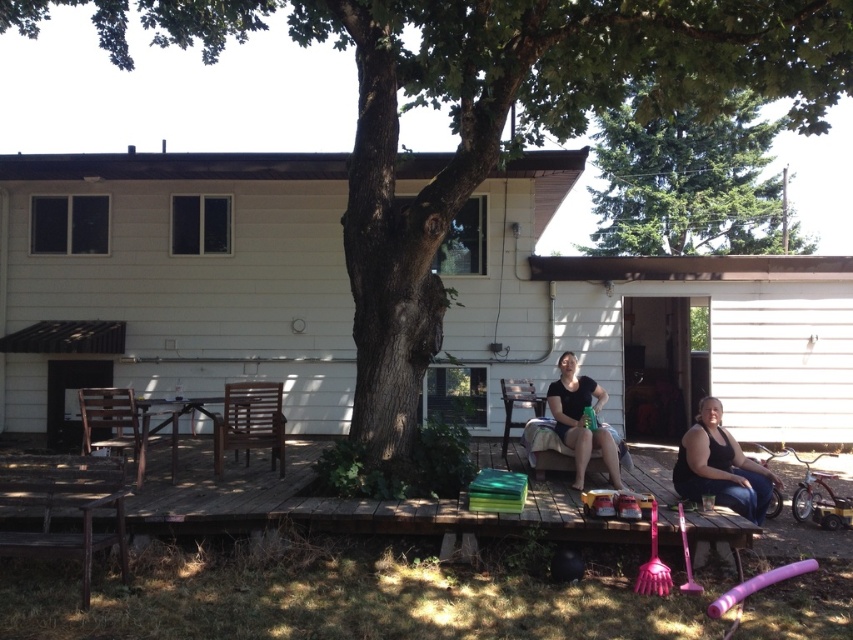
Question: Based on their relative distances, which object is farther from the green leafy tree at upper center?

Choices:
 (A) black fabric woman at lower right
 (B) matte black shirt at center

Answer: (A)

Question: Estimate the real-world distances between objects in this image. Which object is farther from the matte black shorts at center?

Choices:
 (A) matte black shirt at center
 (B) black fabric woman at lower right

Answer: (A)

Question: Which of the following is the farthest from the observer?

Choices:
 (A) matte black shorts at center
 (B) black fabric woman at lower right
 (C) matte black shirt at center
 (D) green leafy tree at upper center

Answer: (D)

Question: Does green leafy tree at upper center have a larger size compared to matte black shorts at center?

Choices:
 (A) no
 (B) yes

Answer: (B)

Question: Is green leafy tree at upper center wider than matte black shorts at center?

Choices:
 (A) yes
 (B) no

Answer: (A)

Question: Is matte black shorts at center positioned before matte black shirt at center?

Choices:
 (A) yes
 (B) no

Answer: (A)